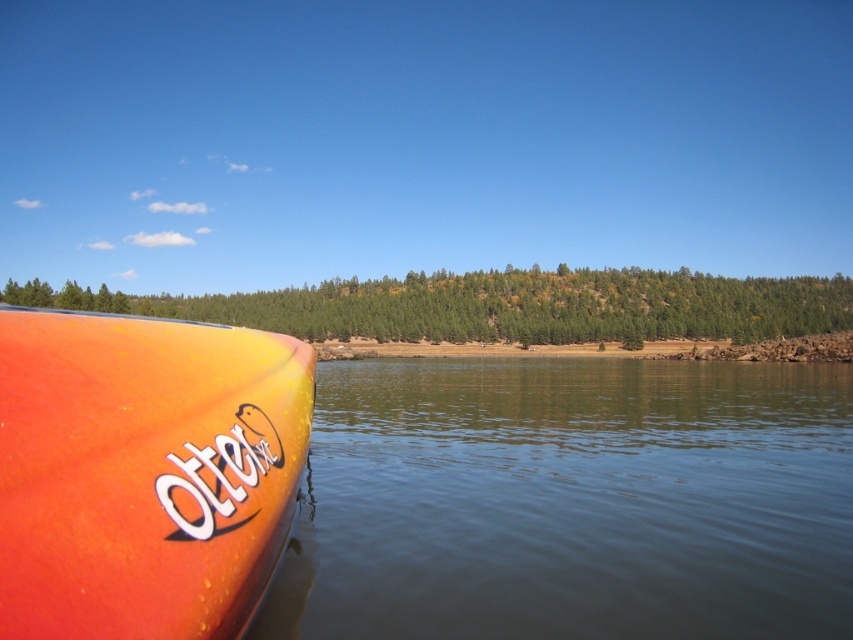
Question: Is orange matte kayak at lower left smaller than green matte tree at center?

Choices:
 (A) no
 (B) yes

Answer: (B)

Question: Which point is farther to the camera?

Choices:
 (A) (845, 577)
 (B) (137, 560)
 (C) (61, 292)

Answer: (C)

Question: Is clear water at lower left closer to the viewer compared to orange matte kayak at lower left?

Choices:
 (A) no
 (B) yes

Answer: (A)

Question: Which of the following is the farthest from the observer?

Choices:
 (A) clear water at lower left
 (B) orange matte kayak at lower left

Answer: (A)

Question: Which of the following is the farthest from the observer?

Choices:
 (A) (408, 461)
 (B) (618, 280)
 (C) (134, 589)

Answer: (B)

Question: Does orange matte kayak at lower left have a larger size compared to green matte tree at center?

Choices:
 (A) yes
 (B) no

Answer: (B)